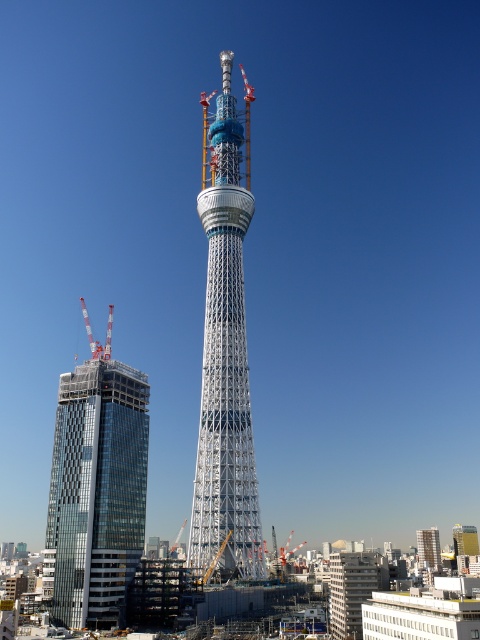
Question: Which point appears closest to the camera in this image?

Choices:
 (A) (429, 547)
 (B) (82, 545)

Answer: (B)

Question: Is glassy modern skyscraper at left thinner than metallic silver building at center?

Choices:
 (A) yes
 (B) no

Answer: (A)

Question: Among these points, which one is farthest from the camera?

Choices:
 (A) (419, 531)
 (B) (216, 436)

Answer: (A)

Question: Which object is the farthest from the white metallic tower at center?

Choices:
 (A) glassy modern skyscraper at left
 (B) metallic construction crane at left
 (C) metallic silver building at center

Answer: (C)

Question: Observing the image, what is the correct spatial positioning of white metallic tower at center in reference to metallic construction crane at left?

Choices:
 (A) right
 (B) left

Answer: (A)

Question: Does white metallic tower at center appear over glassy modern skyscraper at left?

Choices:
 (A) yes
 (B) no

Answer: (A)